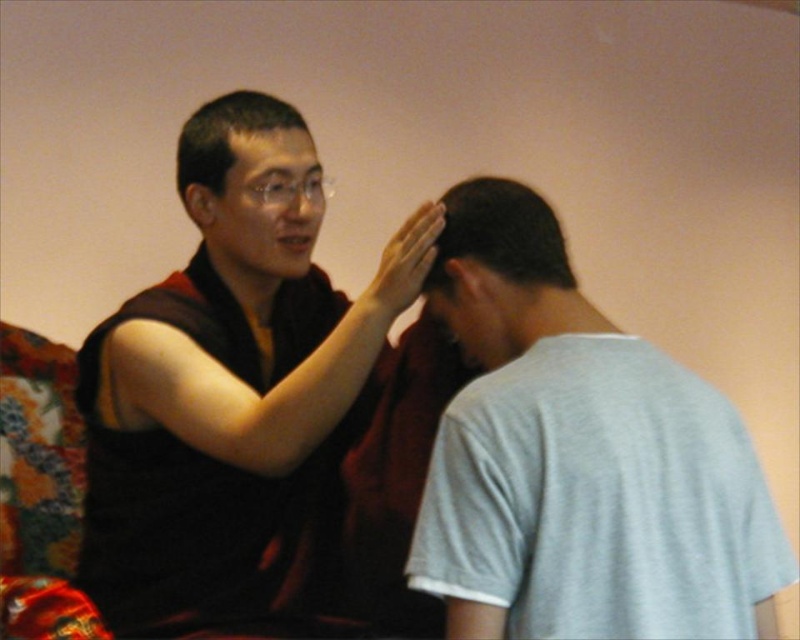
Which is below, light gray cotton t-shirt at center or matte black head at upper center?

light gray cotton t-shirt at center is lower down.

Is light gray cotton t-shirt at center above matte black head at upper center?

Incorrect, light gray cotton t-shirt at center is not positioned above matte black head at upper center.

This screenshot has width=800, height=640. Describe the element at coordinates (580, 458) in the screenshot. I see `light gray cotton t-shirt at center` at that location.

The image size is (800, 640). I want to click on light gray cotton t-shirt at center, so click(580, 458).

Can you confirm if matte black robe at center is positioned above matte black hand at upper center?

Actually, matte black robe at center is below matte black hand at upper center.

Is matte black robe at center to the right of matte black hand at upper center from the viewer's perspective?

Incorrect, matte black robe at center is not on the right side of matte black hand at upper center.

Is point (197, 195) closer to viewer compared to point (402, 284)?

No, (197, 195) is behind (402, 284).

Where is `matte black robe at center`? This screenshot has width=800, height=640. matte black robe at center is located at coordinates (222, 394).

In the scene shown: Between matte black head at upper center and matte black hand at upper center, which one has more height?

Standing taller between the two is matte black head at upper center.

Where is `matte black head at upper center`? The height and width of the screenshot is (640, 800). matte black head at upper center is located at coordinates (252, 184).

Find the location of a particular element. The width and height of the screenshot is (800, 640). matte black head at upper center is located at coordinates (252, 184).